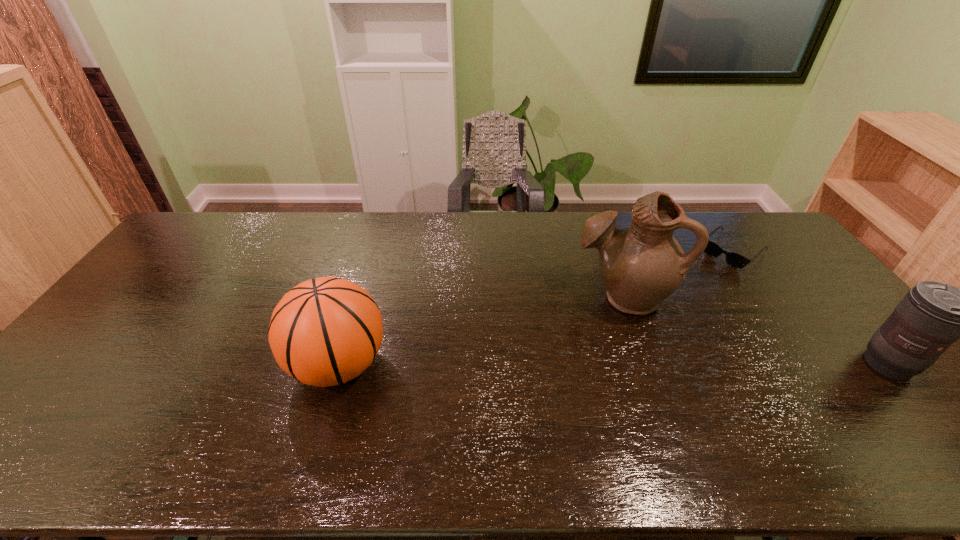
This screenshot has width=960, height=540. In order to click on vacant space on the desktop that is between the basketball and the rightmost object and is positioned at the front lenses of the shortest object in this screenshot , I will do [x=602, y=364].

Find the location of a particular element. This screenshot has width=960, height=540. vacant space on the desktop that is between the leftmost object and the rightmost object and is positioned at the spout of the pitcher is located at coordinates (558, 364).